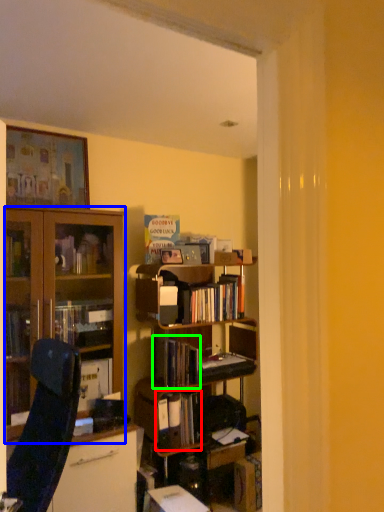
Question: Considering the real-world distances, which object is closest to book (highlighted by a red box)? cabinetry (highlighted by a blue box) or book (highlighted by a green box).

Choices:
 (A) cabinetry
 (B) book

Answer: (B)